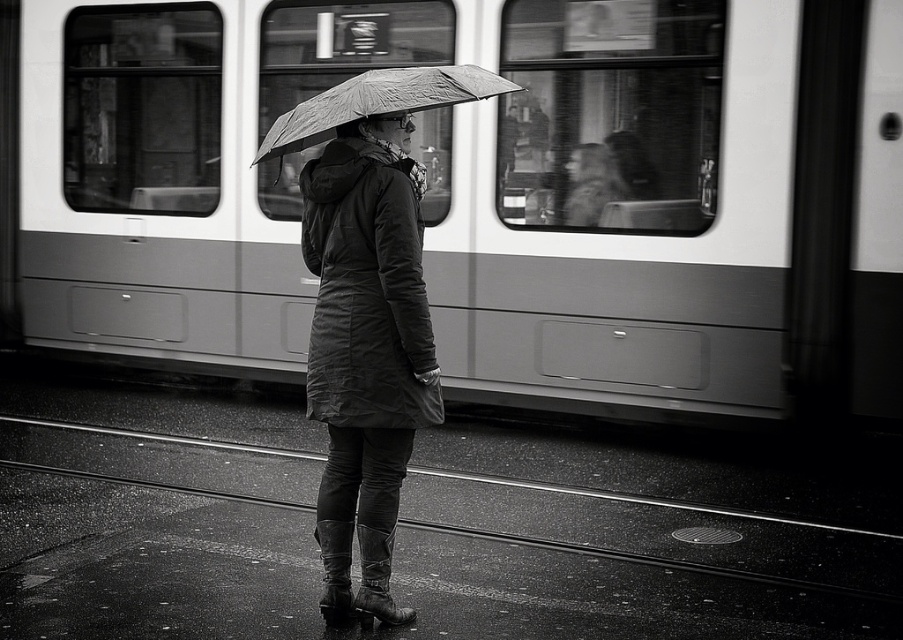
You are a photographer trying to capture both the smooth metal train at center and the textured fabric umbrella at center in a single shot. Which object should you focus on first to ensure both are in the frame?

You should focus on the textured fabric umbrella at center first because it is closer to you than the smooth metal train at center, which is further away. By focusing on the closer object, both will be in focus due to the depth of field.

You are a photographer trying to capture both the smooth metal train at center and the textured fabric umbrella at center in the same frame. Based on their heights, which object should you focus on first to ensure both are in the shot?

The smooth metal train at center is not as tall as the textured fabric umbrella at center, so you should focus on the textured fabric umbrella at center first to ensure both are in the shot.